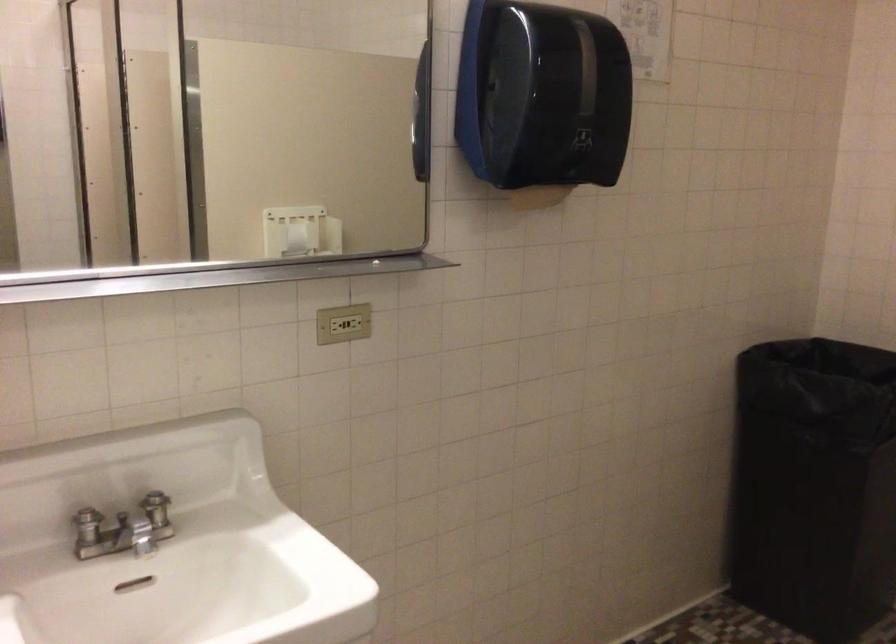
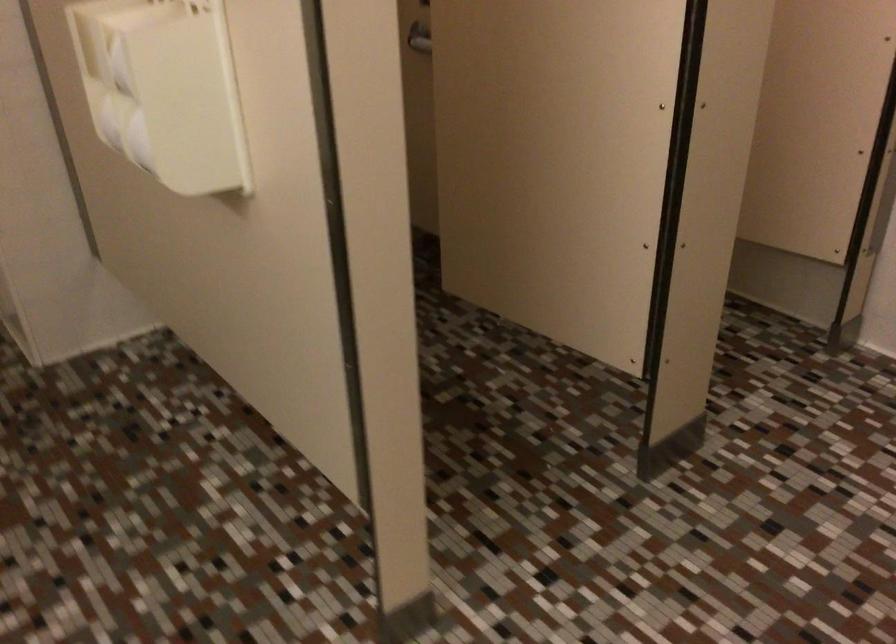
The first image is from the beginning of the video and the second image is from the end. How did the camera likely rotate when shooting the video?

The camera rotated toward right-down.